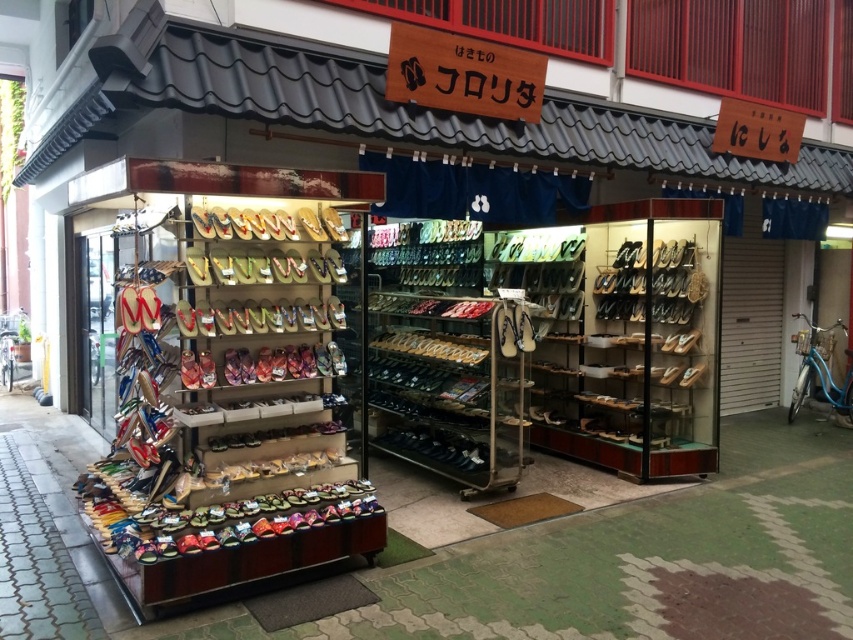
You are standing in front of the shop and want to locate two specific points marked on the display area. The first point is at coordinates point (207, 211) and the second is at point (271, 305). Which point is nearer to you?

Point (207, 211) is closer to the viewer than point (271, 305).